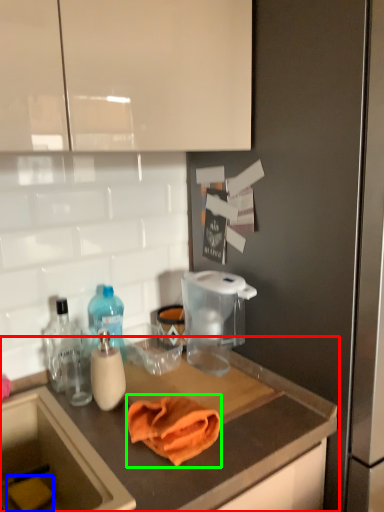
Question: Which object is the closest to the countertop (highlighted by a red box)? Choose among these: food (highlighted by a blue box) or bath towel (highlighted by a green box).

Choices:
 (A) food
 (B) bath towel

Answer: (B)